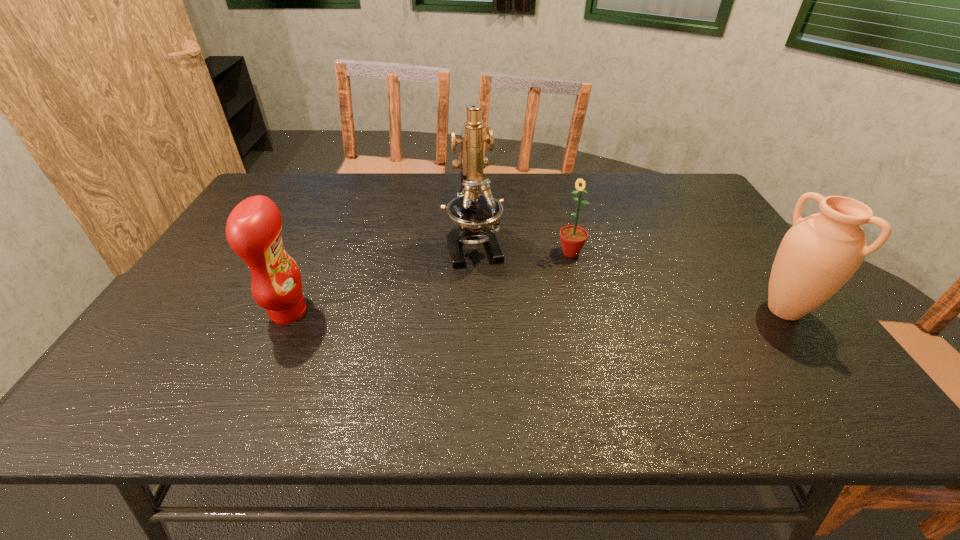
This screenshot has height=540, width=960. What are the coordinates of `blank area in the image that satisfies the following two spatial constraints: 1. on the front side of the shortest object; 2. on the left side of the urn` in the screenshot? It's located at (586, 310).

The height and width of the screenshot is (540, 960). What are the coordinates of `vacant position in the image that satisfies the following two spatial constraints: 1. on the front side of the shortest object; 2. on the left side of the microscope` in the screenshot? It's located at (473, 253).

Where is `vacant region that satisfies the following two spatial constraints: 1. on the front side of the sunflower; 2. on the left side of the second object from left to right`? vacant region that satisfies the following two spatial constraints: 1. on the front side of the sunflower; 2. on the left side of the second object from left to right is located at coordinates (473, 253).